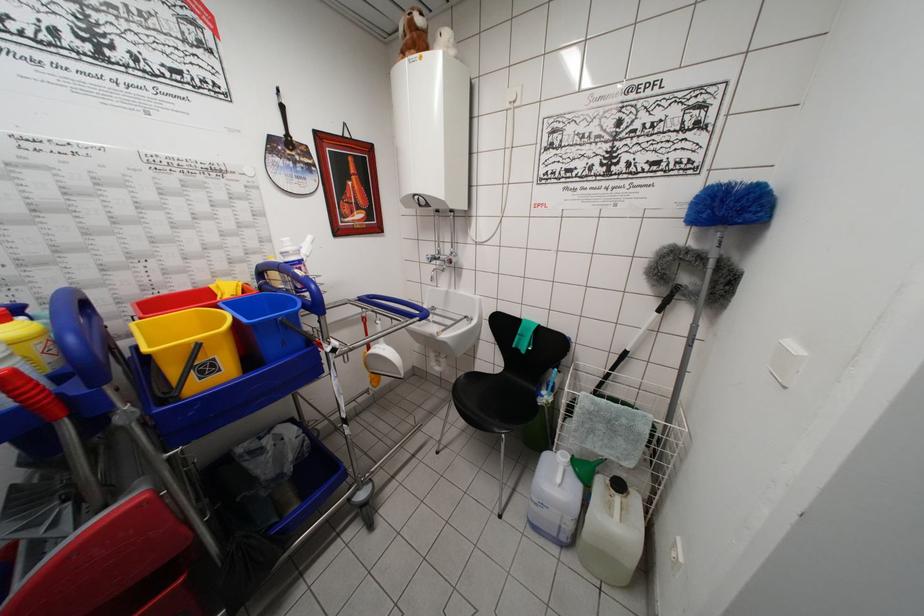
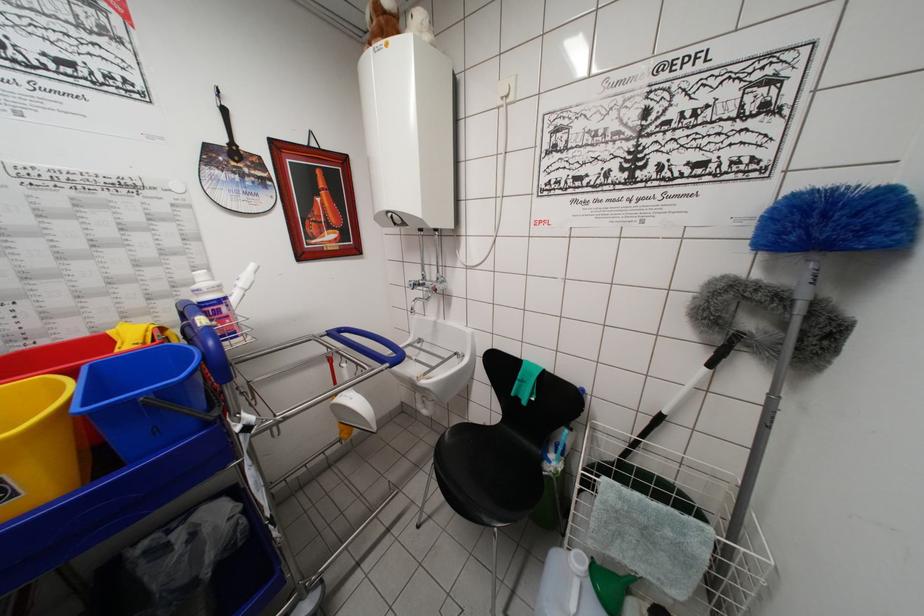
Question: The images are taken continuously from a first-person perspective. In which direction is your viewpoint rotating?

Choices:
 (A) Left
 (B) Right
 (C) Up
 (D) Down

Answer: (C)